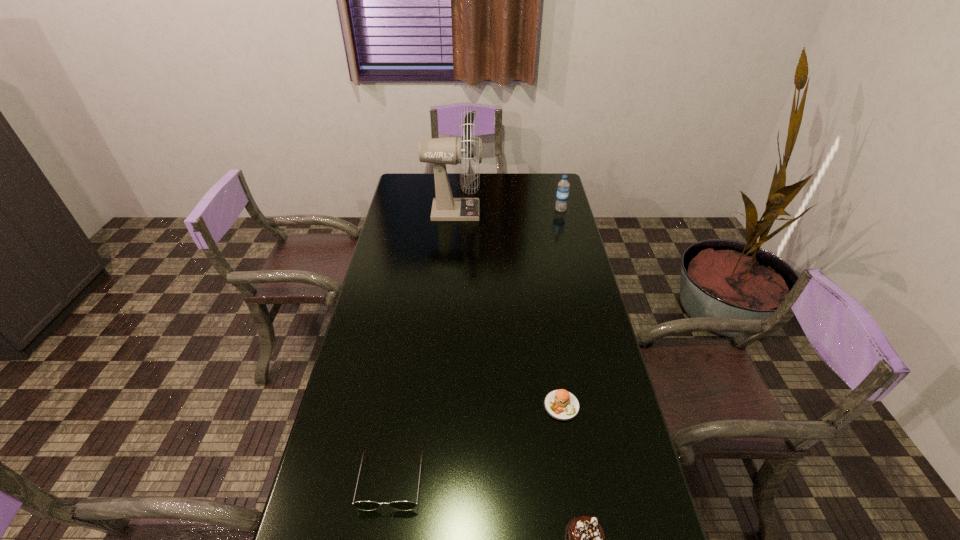
Locate which object ranks third in proximity to the shortest object. Please provide its 2D coordinates. Your answer should be formatted as a tuple, i.e. [(x, y)], where the tuple contains the x and y coordinates of a point satisfying the conditions above.

[(441, 151)]

Find the location of `free spot that satisfies the following two spatial constraints: 1. on the air flow direction of the fan; 2. on the front-facing side of the fourth tallest object`. free spot that satisfies the following two spatial constraints: 1. on the air flow direction of the fan; 2. on the front-facing side of the fourth tallest object is located at coordinates (431, 480).

Locate an element on the screen. free location that satisfies the following two spatial constraints: 1. on the air flow direction of the fan; 2. on the front-facing side of the second shortest object is located at coordinates pos(431,480).